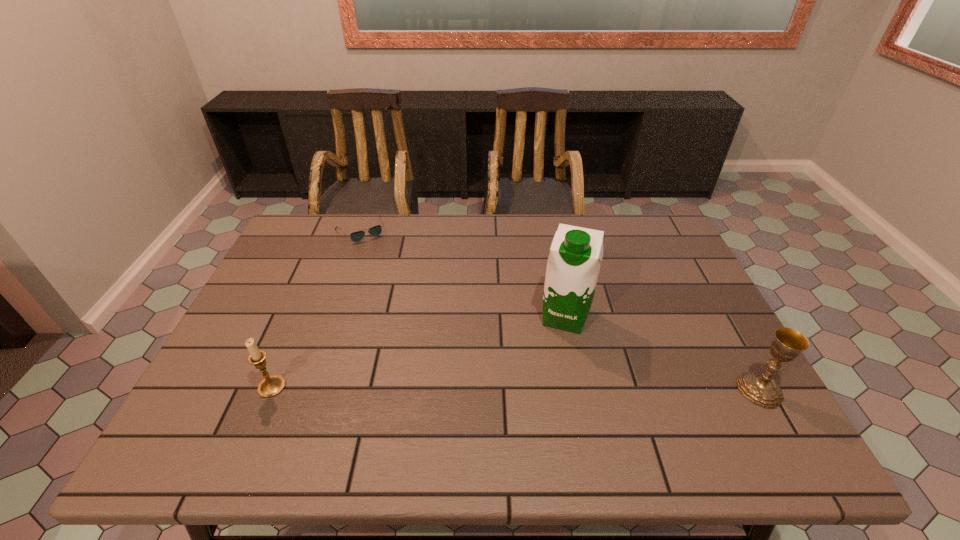
You are a GUI agent. You are given a task and a screenshot of the screen. Output one action in this format:
    pyautogui.click(x=<x>, y=<y>)
    Task: Click on the unoccupied position between the candle holder and the tallest object
    This screenshot has height=540, width=960.
    Given the screenshot: What is the action you would take?
    pyautogui.click(x=419, y=352)

I want to click on free space that is in between the candle holder and the tallest object, so click(x=419, y=352).

Identify the location of free space between the third nearest object and the sunglasses. This screenshot has height=540, width=960. (463, 274).

This screenshot has height=540, width=960. I want to click on free space between the second farthest object and the chalice, so click(x=662, y=353).

Find the location of a particular element. This screenshot has width=960, height=540. vacant area between the chalice and the candle holder is located at coordinates (516, 388).

Where is `free space between the candle holder and the tallest object`? This screenshot has height=540, width=960. free space between the candle holder and the tallest object is located at coordinates (419, 352).

I want to click on object that is the second closest to the second object from right to left, so click(357, 236).

Choose which object is the third nearest neighbor to the second object from right to left. Please provide its 2D coordinates. Your answer should be formatted as a tuple, i.e. [(x, y)], where the tuple contains the x and y coordinates of a point satisfying the conditions above.

[(270, 386)]

Image resolution: width=960 pixels, height=540 pixels. I want to click on vacant space that satisfies the following two spatial constraints: 1. on the front side of the farthest object; 2. on the left side of the second object from right to left, so click(x=330, y=317).

Locate an element on the screen. Image resolution: width=960 pixels, height=540 pixels. vacant space that satisfies the following two spatial constraints: 1. on the front side of the tallest object; 2. on the left side of the farthest object is located at coordinates (330, 317).